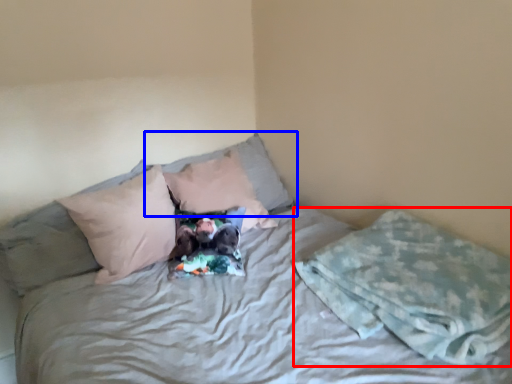
Question: Which object appears closest to the camera in this image, blanket (highlighted by a red box) or pillow (highlighted by a blue box)?

Choices:
 (A) blanket
 (B) pillow

Answer: (A)